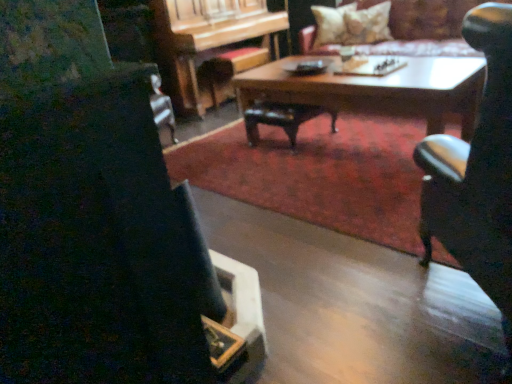
Question: Does fluffy beige pillow at upper right, placed as the 2th pillow when sorted from left to right, come behind velvet beige couch at upper center?

Choices:
 (A) no
 (B) yes

Answer: (B)

Question: Considering the relative sizes of fluffy beige pillow at upper right, placed as the 2th pillow when sorted from left to right, and velvet beige couch at upper center in the image provided, is fluffy beige pillow at upper right, placed as the 2th pillow when sorted from left to right, taller than velvet beige couch at upper center?

Choices:
 (A) no
 (B) yes

Answer: (A)

Question: Is fluffy beige pillow at upper right, placed as the 2th pillow when sorted from left to right, outside velvet beige couch at upper center?

Choices:
 (A) yes
 (B) no

Answer: (B)

Question: Does fluffy beige pillow at upper right, placed as the first pillow when sorted from right to left, touch velvet beige couch at upper center?

Choices:
 (A) yes
 (B) no

Answer: (B)

Question: From a real-world perspective, is fluffy beige pillow at upper right, placed as the 2th pillow when sorted from left to right, located beneath velvet beige couch at upper center?

Choices:
 (A) yes
 (B) no

Answer: (B)

Question: From the image's perspective, is fluffy beige pillow at upper right, placed as the 2th pillow when sorted from left to right, under velvet beige couch at upper center?

Choices:
 (A) yes
 (B) no

Answer: (B)

Question: From a real-world perspective, is velvet beige couch at upper center physically above wooden piano at center?

Choices:
 (A) yes
 (B) no

Answer: (A)

Question: From the image's perspective, would you say velvet beige couch at upper center is shown under wooden piano at center?

Choices:
 (A) yes
 (B) no

Answer: (A)

Question: Is velvet beige couch at upper center facing away from wooden piano at center?

Choices:
 (A) no
 (B) yes

Answer: (A)

Question: Are velvet beige couch at upper center and wooden piano at center far apart?

Choices:
 (A) no
 (B) yes

Answer: (B)

Question: Is the position of velvet beige couch at upper center more distant than that of wooden piano at center?

Choices:
 (A) no
 (B) yes

Answer: (A)

Question: Can you confirm if velvet beige couch at upper center is thinner than wooden piano at center?

Choices:
 (A) yes
 (B) no

Answer: (B)

Question: From the image's perspective, is wooden piano at center located above wooden coffee table at center?

Choices:
 (A) yes
 (B) no

Answer: (A)